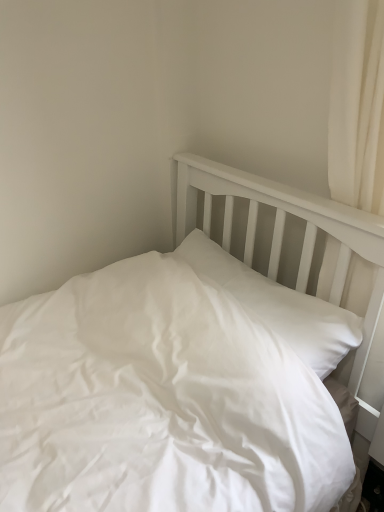
You are a GUI agent. You are given a task and a screenshot of the screen. Output one action in this format:
    pyautogui.click(x=<x>, y=<y>)
    Task: Click on the satin white pillow at center
    The height and width of the screenshot is (512, 384).
    Given the screenshot: What is the action you would take?
    pyautogui.click(x=279, y=305)

The height and width of the screenshot is (512, 384). What do you see at coordinates (279, 305) in the screenshot? I see `satin white pillow at center` at bounding box center [279, 305].

This screenshot has width=384, height=512. What are the coordinates of `satin white pillow at center` in the screenshot? It's located at (279, 305).